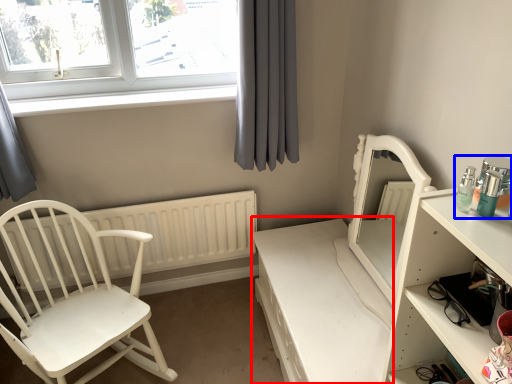
Question: Which of the following is the farthest to the observer, vanity (highlighted by a red box) or toiletry (highlighted by a blue box)?

Choices:
 (A) vanity
 (B) toiletry

Answer: (A)